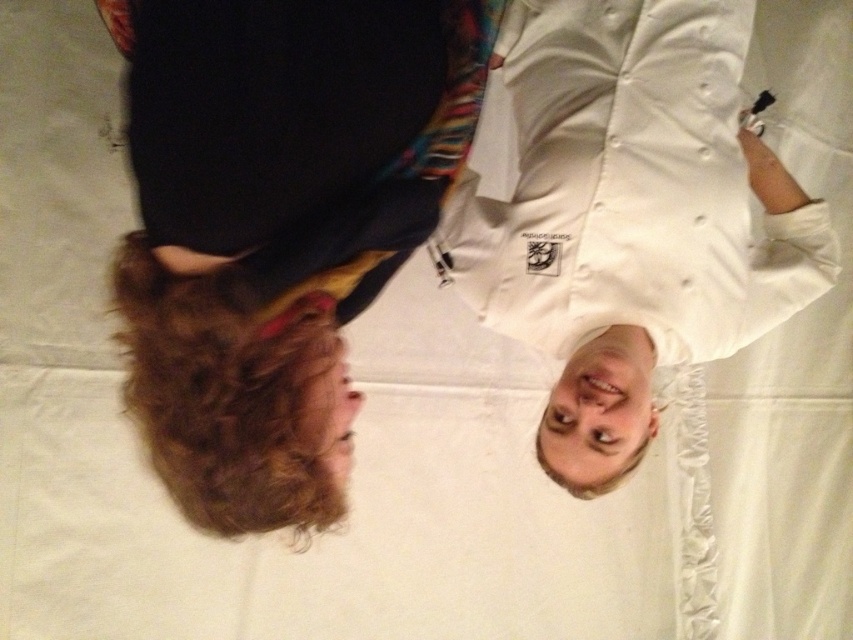
Does dark brown curly hair at left appear on the left side of white matte chef's coat at upper right?

Correct, you'll find dark brown curly hair at left to the left of white matte chef's coat at upper right.

Locate an element on the screen. dark brown curly hair at left is located at coordinates (277, 225).

Locate an element on the screen. The height and width of the screenshot is (640, 853). dark brown curly hair at left is located at coordinates point(277,225).

The height and width of the screenshot is (640, 853). Find the location of `dark brown curly hair at left`. dark brown curly hair at left is located at coordinates (277, 225).